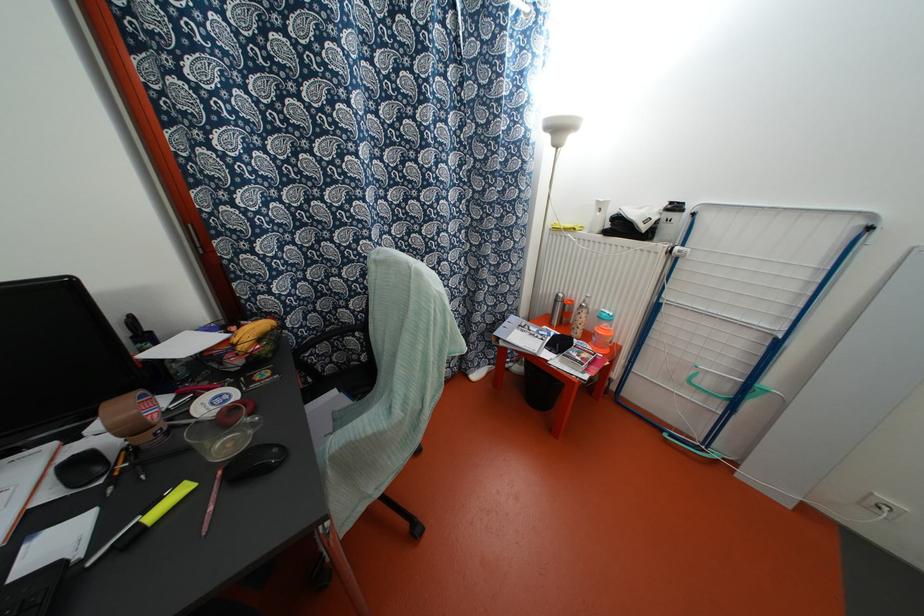
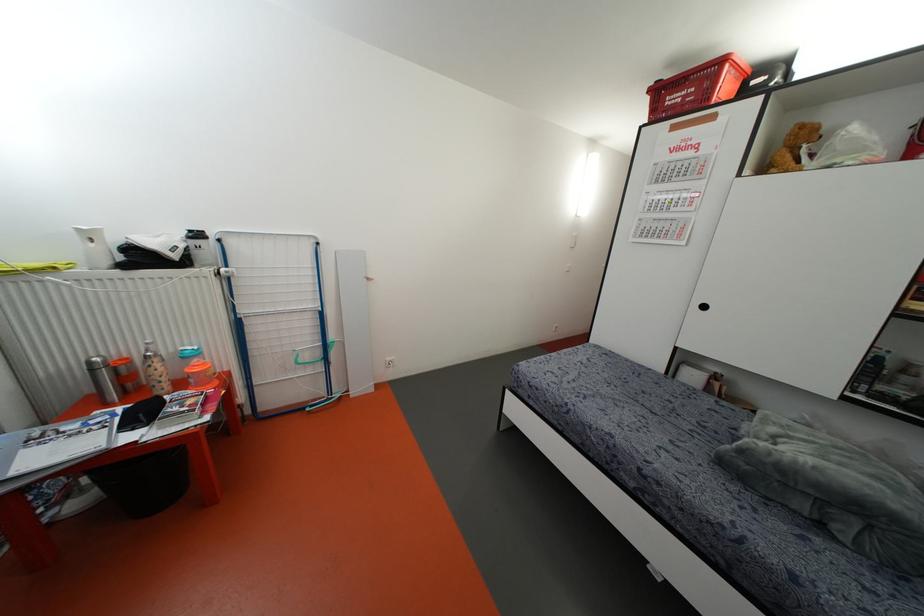
The point at [554,301] is marked in the first image. Where is the corresponding point in the second image?

(91, 370)